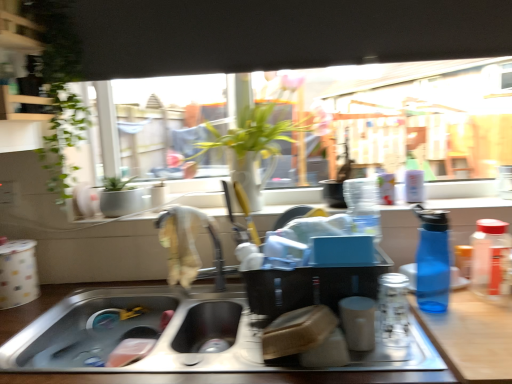
Question: Can you confirm if silver metallic faucet at center is shorter than transparent glass window at center?

Choices:
 (A) no
 (B) yes

Answer: (B)

Question: Is transparent glass window at center surrounded by silver metallic faucet at center?

Choices:
 (A) no
 (B) yes

Answer: (A)

Question: Considering the relative sizes of silver metallic faucet at center and transparent glass window at center in the image provided, is silver metallic faucet at center taller than transparent glass window at center?

Choices:
 (A) no
 (B) yes

Answer: (A)

Question: Is silver metallic faucet at center wider than transparent glass window at center?

Choices:
 (A) no
 (B) yes

Answer: (B)

Question: Can you confirm if silver metallic faucet at center is thinner than transparent glass window at center?

Choices:
 (A) no
 (B) yes

Answer: (A)

Question: Is silver metallic faucet at center to the left of transparent glass window at center from the viewer's perspective?

Choices:
 (A) yes
 (B) no

Answer: (A)

Question: Is green leafy plant at center to the left of transparent glass jar at right, arranged as the first bottle when viewed from the right, from the viewer's perspective?

Choices:
 (A) yes
 (B) no

Answer: (A)

Question: Does green leafy plant at center have a greater height compared to transparent glass jar at right, arranged as the first bottle when viewed from the right?

Choices:
 (A) no
 (B) yes

Answer: (B)

Question: Is green leafy plant at center at the right side of transparent glass jar at right, which appears as the 3th bottle when viewed from the left?

Choices:
 (A) no
 (B) yes

Answer: (A)

Question: Is green leafy plant at center completely or partially outside of transparent glass jar at right, arranged as the first bottle when viewed from the right?

Choices:
 (A) no
 (B) yes

Answer: (B)

Question: Is the position of green leafy plant at center more distant than that of transparent glass jar at right, arranged as the first bottle when viewed from the right?

Choices:
 (A) no
 (B) yes

Answer: (B)

Question: From a real-world perspective, does green leafy plant at center stand above transparent glass jar at right, arranged as the first bottle when viewed from the right?

Choices:
 (A) no
 (B) yes

Answer: (B)

Question: Is blue translucent bottle at right, which is the second bottle from left to right, turned away from wooden counter at lower right?

Choices:
 (A) yes
 (B) no

Answer: (B)